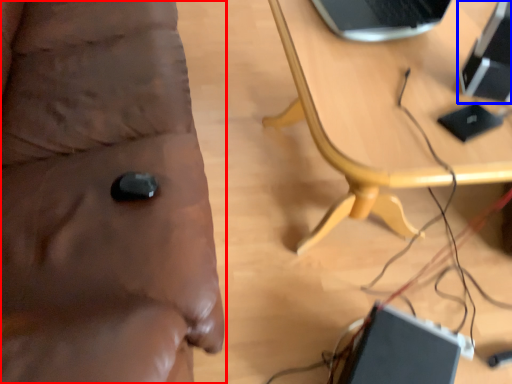
Question: Among these objects, which one is nearest to the camera, furniture (highlighted by a red box) or computer (highlighted by a blue box)?

Choices:
 (A) furniture
 (B) computer

Answer: (A)